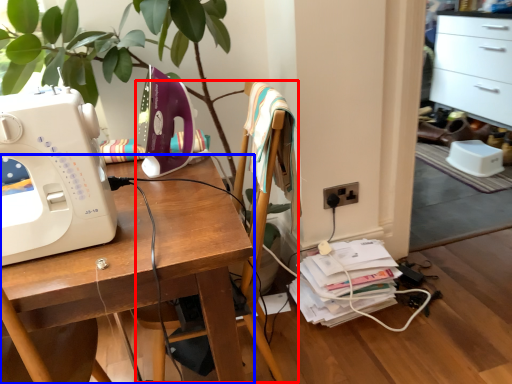
Question: Which point is closer to the camera, chair (highlighted by a red box) or desk (highlighted by a blue box)?

Choices:
 (A) chair
 (B) desk

Answer: (B)